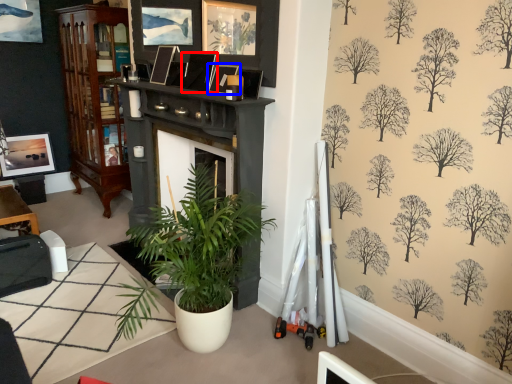
Question: Which object appears farthest to the camera in this image, picture frame (highlighted by a red box) or picture frame (highlighted by a blue box)?

Choices:
 (A) picture frame
 (B) picture frame

Answer: (A)